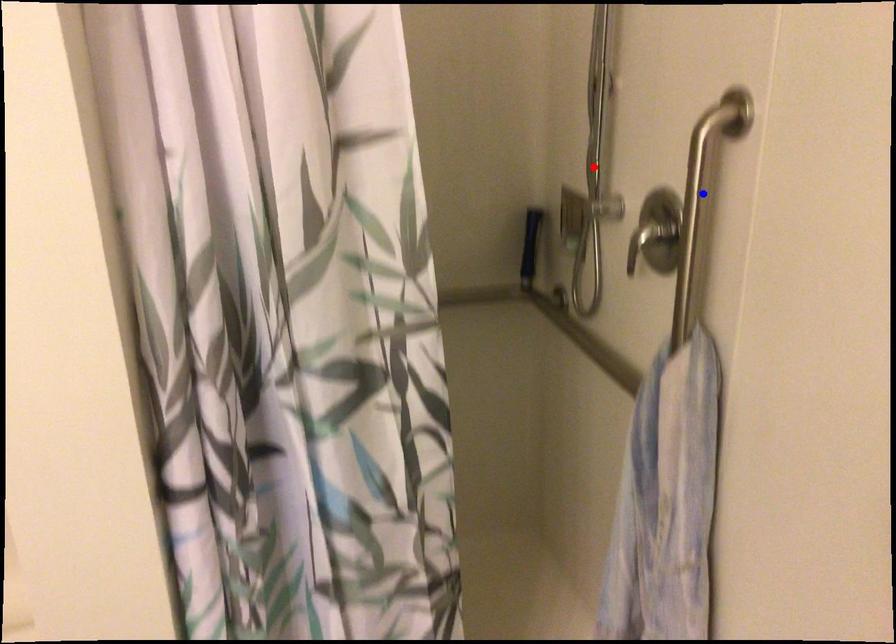
Question: In the image, two points are highlighted. Which point is nearer to the camera? Reply with the corresponding letter.

Choices:
 (A) blue point
 (B) red point

Answer: (A)